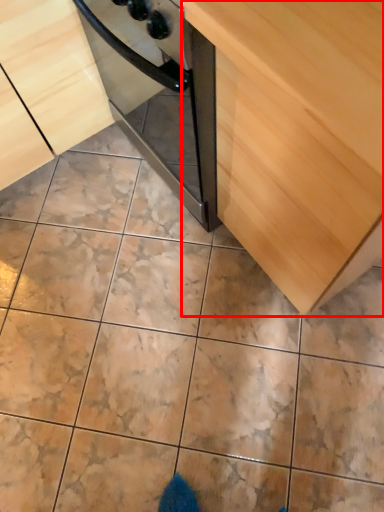
Question: From the image's perspective, where is cabinetry (annotated by the red box) located in relation to cabinetry in the image?

Choices:
 (A) below
 (B) above

Answer: (A)